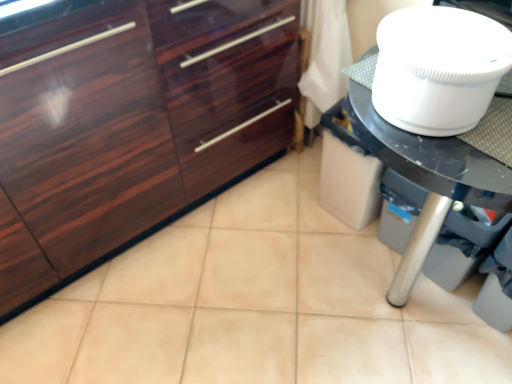
Question: Should I look upward or downward to see white glossy table at right?

Choices:
 (A) up
 (B) down

Answer: (B)

Question: Is white plastic toilet bowl at upper right inside glossy wood cabinetry at left?

Choices:
 (A) no
 (B) yes

Answer: (A)

Question: Is glossy wood cabinetry at left at the left side of white plastic toilet bowl at upper right?

Choices:
 (A) yes
 (B) no

Answer: (A)

Question: Is glossy wood cabinetry at left outside white plastic toilet bowl at upper right?

Choices:
 (A) yes
 (B) no

Answer: (A)

Question: Can you confirm if glossy wood cabinetry at left is taller than white plastic toilet bowl at upper right?

Choices:
 (A) no
 (B) yes

Answer: (B)

Question: Is glossy wood cabinetry at left closer to the viewer compared to white plastic toilet bowl at upper right?

Choices:
 (A) yes
 (B) no

Answer: (B)

Question: Can you confirm if glossy wood cabinetry at left is bigger than white plastic toilet bowl at upper right?

Choices:
 (A) no
 (B) yes

Answer: (B)

Question: Does white glossy table at right have a greater width compared to white plastic toilet bowl at upper right?

Choices:
 (A) yes
 (B) no

Answer: (A)

Question: Can you confirm if white glossy table at right is positioned to the right of white plastic toilet bowl at upper right?

Choices:
 (A) no
 (B) yes

Answer: (B)

Question: Is white glossy table at right far away from white plastic toilet bowl at upper right?

Choices:
 (A) yes
 (B) no

Answer: (B)

Question: Considering the relative sizes of white glossy table at right and white plastic toilet bowl at upper right in the image provided, is white glossy table at right taller than white plastic toilet bowl at upper right?

Choices:
 (A) no
 (B) yes

Answer: (B)

Question: Could you tell me if white glossy table at right is turned towards white plastic toilet bowl at upper right?

Choices:
 (A) yes
 (B) no

Answer: (B)

Question: From the image's perspective, does white glossy table at right appear higher than white plastic toilet bowl at upper right?

Choices:
 (A) yes
 (B) no

Answer: (B)

Question: Is glossy wood cabinetry at left completely or partially inside white plastic toilet bowl at upper right?

Choices:
 (A) yes
 (B) no

Answer: (B)